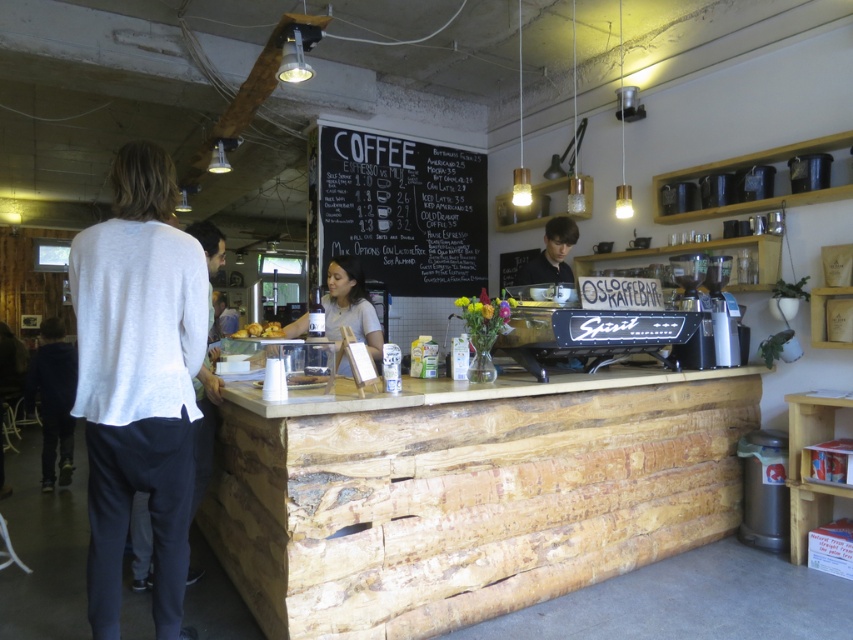
Who is positioned more to the right, white matte sweater at left or smooth black shirt at center?

Positioned to the right is smooth black shirt at center.

At what (x,y) coordinates should I click in order to perform the action: click on white matte sweater at left. Please return your answer as a coordinate pair (x, y). Image resolution: width=853 pixels, height=640 pixels. Looking at the image, I should click on (202, 429).

At what (x,y) coordinates should I click in order to perform the action: click on white matte sweater at left. Please return your answer as a coordinate pair (x, y). Looking at the image, I should click on (202, 429).

What do you see at coordinates (202, 429) in the screenshot? Image resolution: width=853 pixels, height=640 pixels. I see `white matte sweater at left` at bounding box center [202, 429].

Can you confirm if white matte sweater at left is positioned above matte black wine bottle at center?

Incorrect, white matte sweater at left is not positioned above matte black wine bottle at center.

What do you see at coordinates (202, 429) in the screenshot?
I see `white matte sweater at left` at bounding box center [202, 429].

Find the location of `white matte sweater at left`. white matte sweater at left is located at coordinates (202, 429).

Who is taller, black chalkboard at center or golden brown pastry at center?

black chalkboard at center is taller.

Does point (430, 273) come farther from viewer compared to point (250, 333)?

Yes.

Locate an element on the screen. Image resolution: width=853 pixels, height=640 pixels. black chalkboard at center is located at coordinates (398, 211).